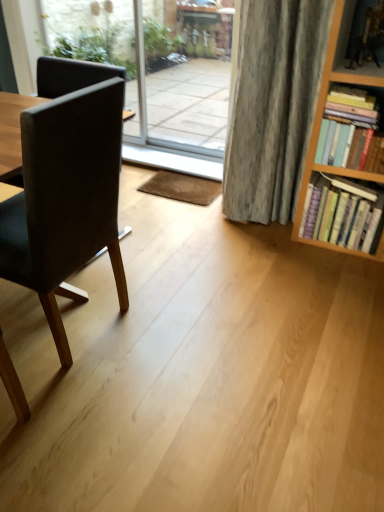
Question: Relative to transparent glass screen door at center, is black leather chair at left in front or behind?

Choices:
 (A) front
 (B) behind

Answer: (B)

Question: From the image's perspective, relative to transparent glass screen door at center, is black leather chair at left above or below?

Choices:
 (A) above
 (B) below

Answer: (A)

Question: Which is farther from the matte black chair at left?

Choices:
 (A) black leather chair at left
 (B) wooden bookshelf at right
 (C) hardcover books at right, the second book in the bottom-to-top sequence
 (D) transparent glass screen door at center
 (E) hardcover books at right, arranged as the first book when ordered from the bottom

Answer: (A)

Question: Which object is the farthest from the wooden bookshelf at right?

Choices:
 (A) transparent glass screen door at center
 (B) black leather chair at left
 (C) hardcover books at right, arranged as the second book when viewed from the top
 (D) hardcover books at right, the second book in the bottom-to-top sequence
 (E) matte black chair at left

Answer: (B)